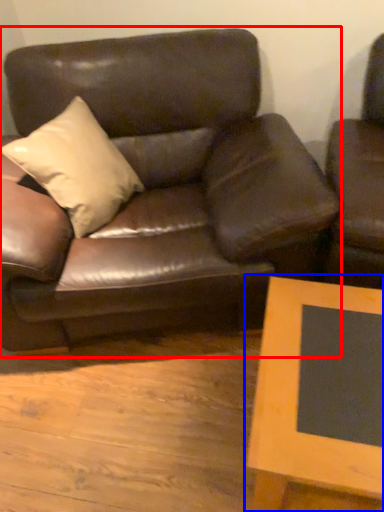
Question: Among these objects, which one is nearest to the camera, studio couch (highlighted by a red box) or table (highlighted by a blue box)?

Choices:
 (A) studio couch
 (B) table

Answer: (B)